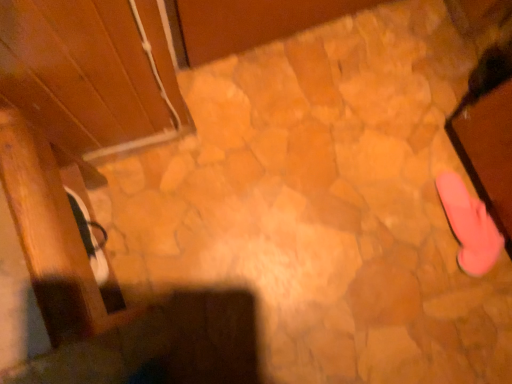
This screenshot has width=512, height=384. What do you see at coordinates (469, 225) in the screenshot?
I see `pink fabric flip-flop at right` at bounding box center [469, 225].

Where is `pink fabric flip-flop at right`? pink fabric flip-flop at right is located at coordinates (469, 225).

Where is `pink fabric flip-flop at right`? The width and height of the screenshot is (512, 384). pink fabric flip-flop at right is located at coordinates (469, 225).